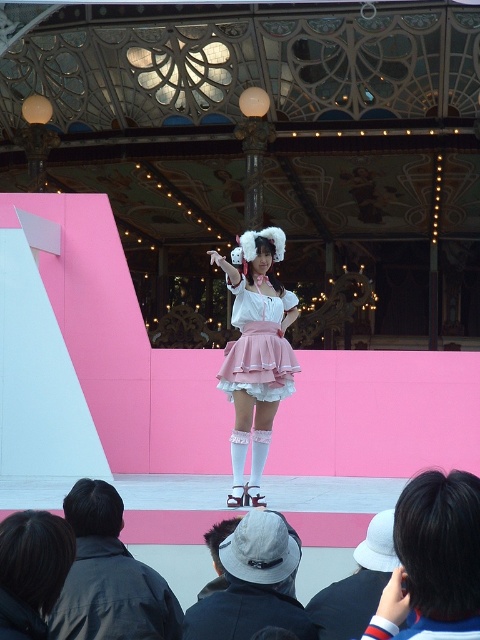
Question: Is dark brown hair at lower left wider than pink satin skirt at center?

Choices:
 (A) yes
 (B) no

Answer: (A)

Question: Does matte pink skirt at center have a larger size compared to pink satin skirt at center?

Choices:
 (A) yes
 (B) no

Answer: (A)

Question: Estimate the real-world distances between objects in this image. Which object is farther from the gray felt hat at lower center?

Choices:
 (A) white fabric hat at lower right
 (B) matte pink skirt at center
 (C) white cotton hat at lower center

Answer: (B)

Question: Can you confirm if white fabric hat at lower right is bigger than matte pink skirt at center?

Choices:
 (A) yes
 (B) no

Answer: (B)

Question: Which object is farther from the camera taking this photo?

Choices:
 (A) matte pink skirt at center
 (B) white cotton hat at lower center

Answer: (A)

Question: Which of the following is the closest to the observer?

Choices:
 (A) coord(373,518)
 (B) coord(218,605)

Answer: (B)